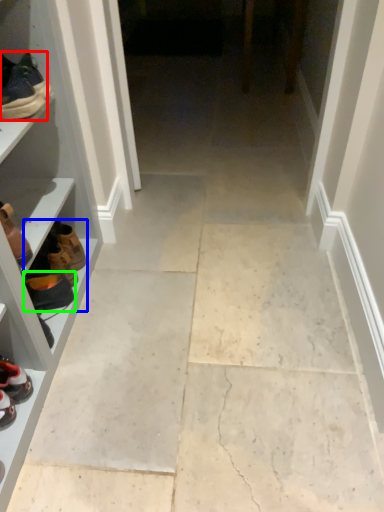
Question: Based on their relative distances, which object is nearer to footwear (highlighted by a red box)? Choose from shoe (highlighted by a blue box) and footwear (highlighted by a green box).

Choices:
 (A) shoe
 (B) footwear

Answer: (A)